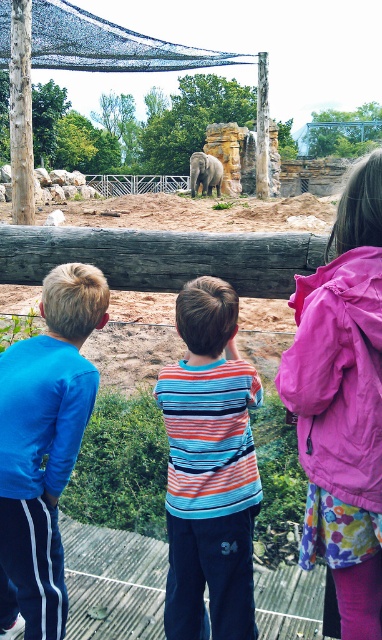
Question: Does striped cotton shirt at center appear on the right side of gray rough log at center?

Choices:
 (A) yes
 (B) no

Answer: (A)

Question: Does gray rough log at center appear on the left side of gray textured elephant at center?

Choices:
 (A) no
 (B) yes

Answer: (B)

Question: Which of these objects is positioned closest to the gray textured elephant at center?

Choices:
 (A) blue track pants at left
 (B) pink fabric jacket at upper right

Answer: (A)

Question: Does pink fabric jacket at upper right have a smaller size compared to gray rough log at center?

Choices:
 (A) no
 (B) yes

Answer: (B)

Question: Which of the following is the farthest from the observer?

Choices:
 (A) (113, 276)
 (B) (12, 545)

Answer: (A)

Question: Which object is the farthest from the gray textured elephant at center?

Choices:
 (A) striped cotton shirt at center
 (B) blue track pants at left

Answer: (B)